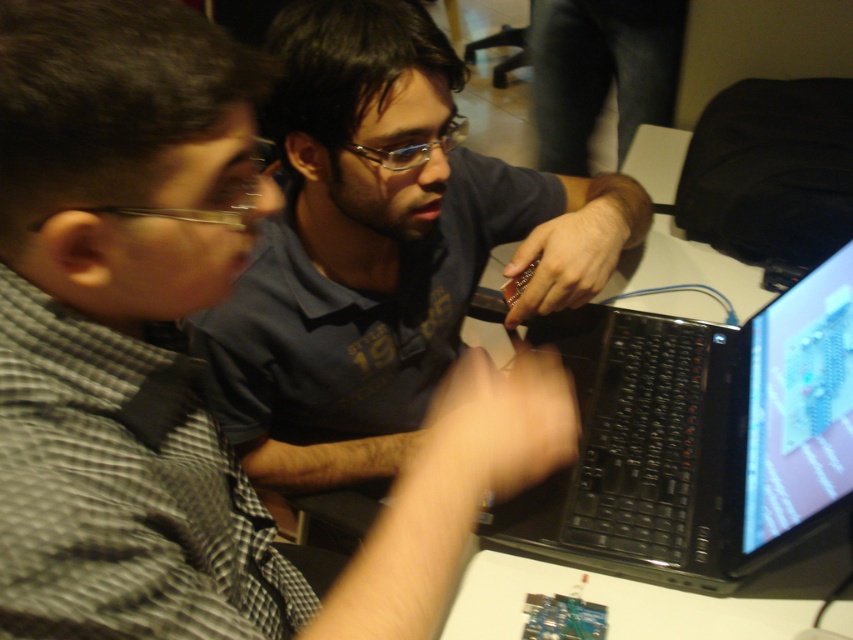
Question: Considering the real-world distances, which object is closest to the shiny plastic monitor at upper right?

Choices:
 (A) black matte laptop at center
 (B) matte black shirt at center

Answer: (A)

Question: Among these objects, which one is farthest from the camera?

Choices:
 (A) matte black shirt at center
 (B) black matte laptop at center
 (C) dark blue jeans at center

Answer: (C)

Question: Where is matte black shirt at center located in relation to dark blue jeans at center in the image?

Choices:
 (A) below
 (B) above

Answer: (A)

Question: Does shiny plastic monitor at upper right have a smaller size compared to dark blue jeans at center?

Choices:
 (A) yes
 (B) no

Answer: (A)

Question: Among these objects, which one is farthest from the camera?

Choices:
 (A) shiny plastic monitor at upper right
 (B) dark blue jeans at center
 (C) black matte laptop at center
 (D) matte black shirt at center

Answer: (B)

Question: Where is matte black shirt at center located in relation to shiny plastic monitor at upper right in the image?

Choices:
 (A) left
 (B) right

Answer: (A)